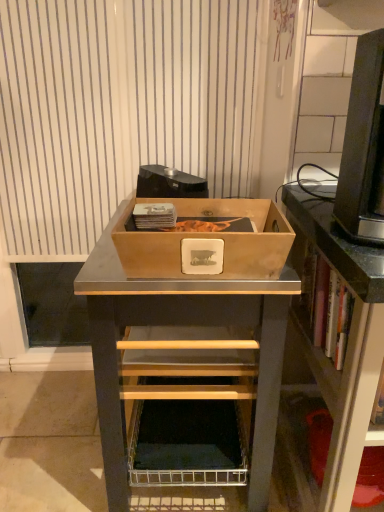
Question: Can you confirm if black plastic desktop computer at upper right is bigger than wooden box at center?

Choices:
 (A) no
 (B) yes

Answer: (A)

Question: From a real-world perspective, is black plastic desktop computer at upper right positioned under wooden box at center based on gravity?

Choices:
 (A) yes
 (B) no

Answer: (B)

Question: Does black plastic desktop computer at upper right come behind wooden box at center?

Choices:
 (A) no
 (B) yes

Answer: (A)

Question: Considering the relative sizes of black plastic desktop computer at upper right and wooden box at center in the image provided, is black plastic desktop computer at upper right thinner than wooden box at center?

Choices:
 (A) no
 (B) yes

Answer: (B)

Question: Could you tell me if black plastic desktop computer at upper right is facing wooden box at center?

Choices:
 (A) no
 (B) yes

Answer: (A)

Question: Is black plastic desktop computer at upper right far from wooden box at center?

Choices:
 (A) no
 (B) yes

Answer: (A)

Question: Considering the relative sizes of matte black shelf at right and white striped curtain at upper center in the image provided, is matte black shelf at right smaller than white striped curtain at upper center?

Choices:
 (A) no
 (B) yes

Answer: (A)

Question: Can you confirm if matte black shelf at right is shorter than white striped curtain at upper center?

Choices:
 (A) no
 (B) yes

Answer: (B)

Question: Considering the relative sizes of matte black shelf at right and white striped curtain at upper center in the image provided, is matte black shelf at right thinner than white striped curtain at upper center?

Choices:
 (A) no
 (B) yes

Answer: (A)

Question: Does matte black shelf at right turn towards white striped curtain at upper center?

Choices:
 (A) no
 (B) yes

Answer: (A)

Question: Is matte black shelf at right positioned with its back to white striped curtain at upper center?

Choices:
 (A) no
 (B) yes

Answer: (A)

Question: Is matte black shelf at right to the left of white striped curtain at upper center from the viewer's perspective?

Choices:
 (A) no
 (B) yes

Answer: (A)

Question: Does matte black shelf at right have a greater width compared to wooden box at center?

Choices:
 (A) yes
 (B) no

Answer: (B)